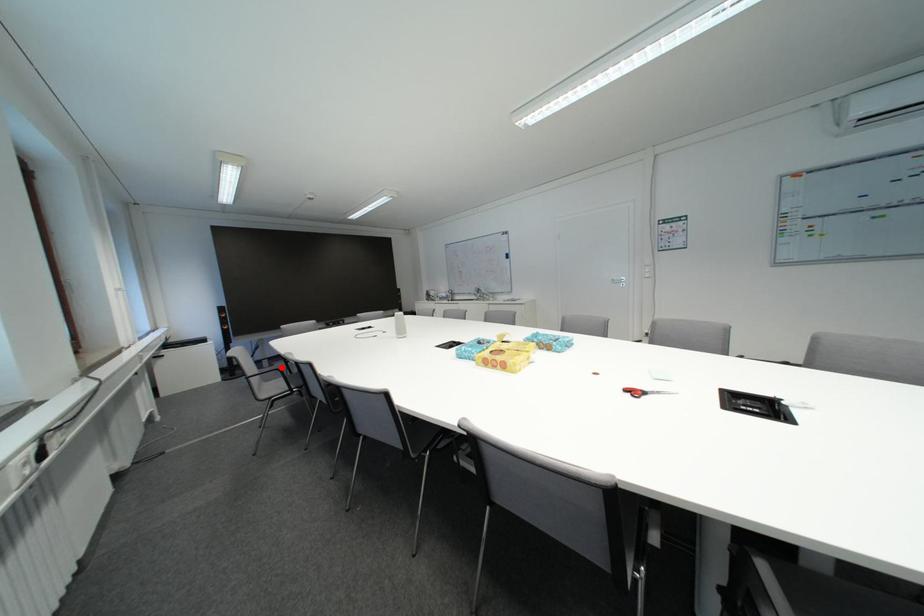
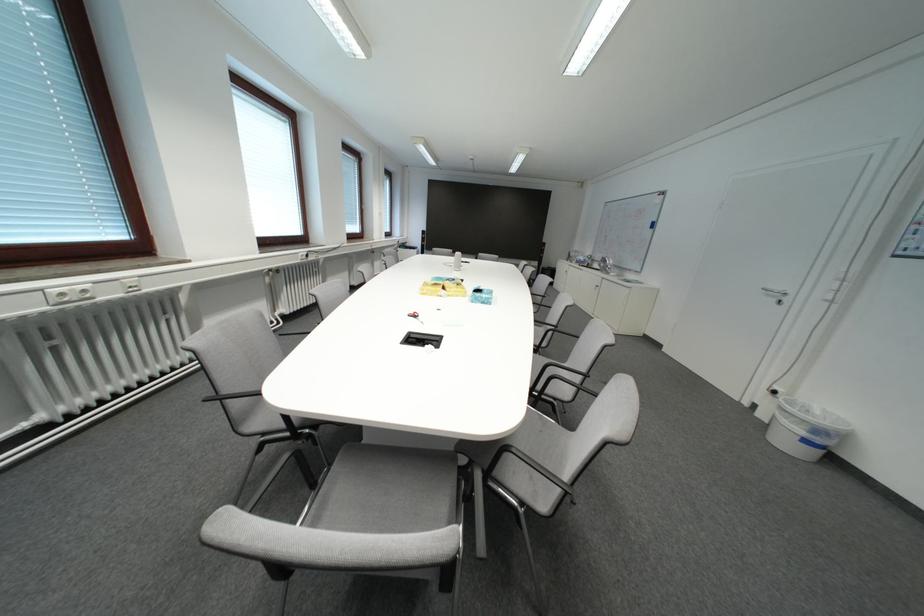
Question: I am providing you with two images of the same scene from different viewpoints. A red point is marked on the first image. Can you still see the location of the red point in image 2?

Choices:
 (A) Yes
 (B) No

Answer: (B)